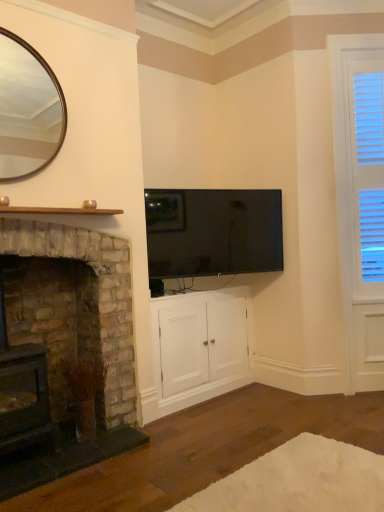
Find the location of `free space above white wood blinds at right (from a real-world perspective)`. free space above white wood blinds at right (from a real-world perspective) is located at coordinates (358, 35).